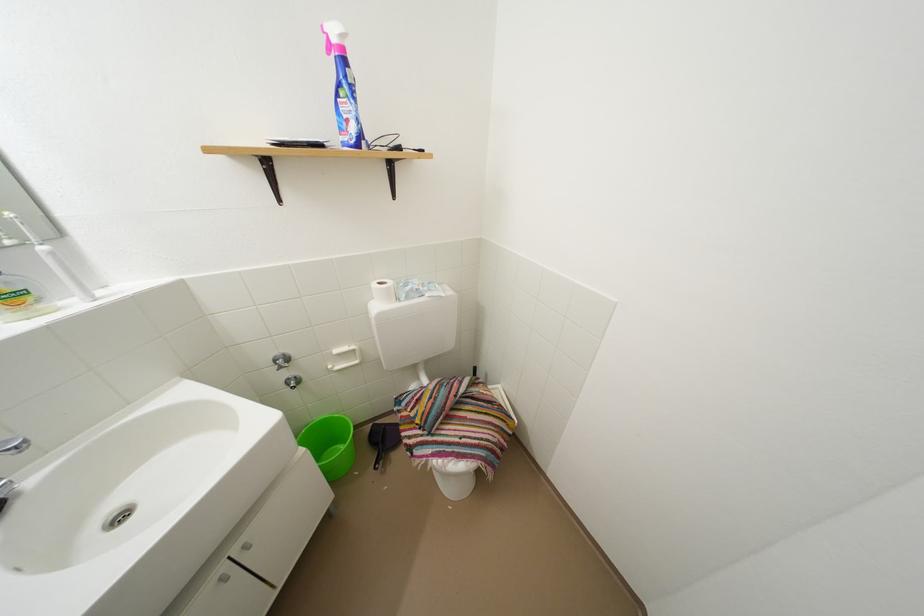
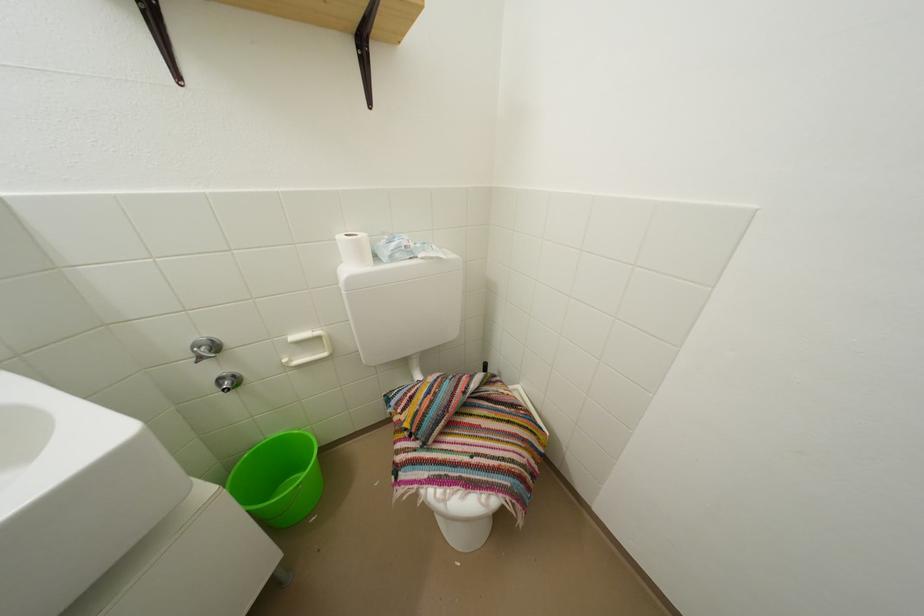
In the second image, find the point that corresponds to point (388, 289) in the first image.

(360, 240)